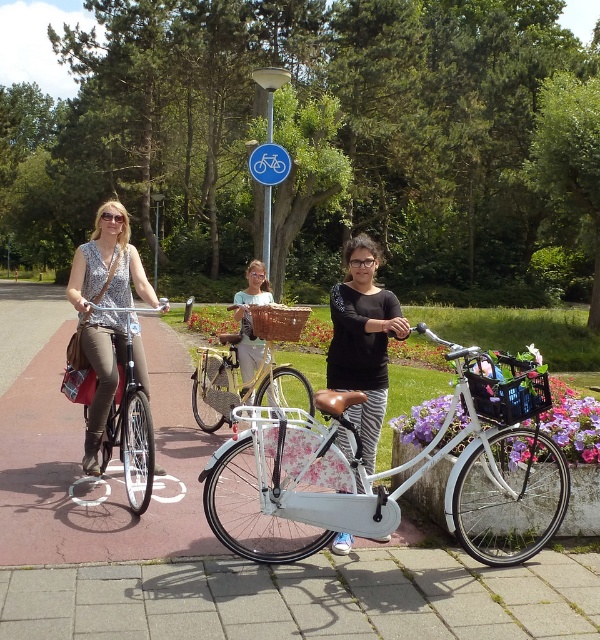
You are planning to repaint the gray concrete pavement at lower center and the yellow matte bicycle at center. If you want to use the least amount of paint, which object should you choose to paint?

The gray concrete pavement at lower center occupies less space than the yellow matte bicycle at center, so painting the gray concrete pavement at lower center would require less paint.

You are standing at the edge of the park and want to reach the gray concrete pavement at lower center. According to the coordinates provided, in which direction should you walk to reach it?

The gray concrete pavement at lower center is located at coordinates point (307, 596), so you should walk towards the lower center direction to reach it.